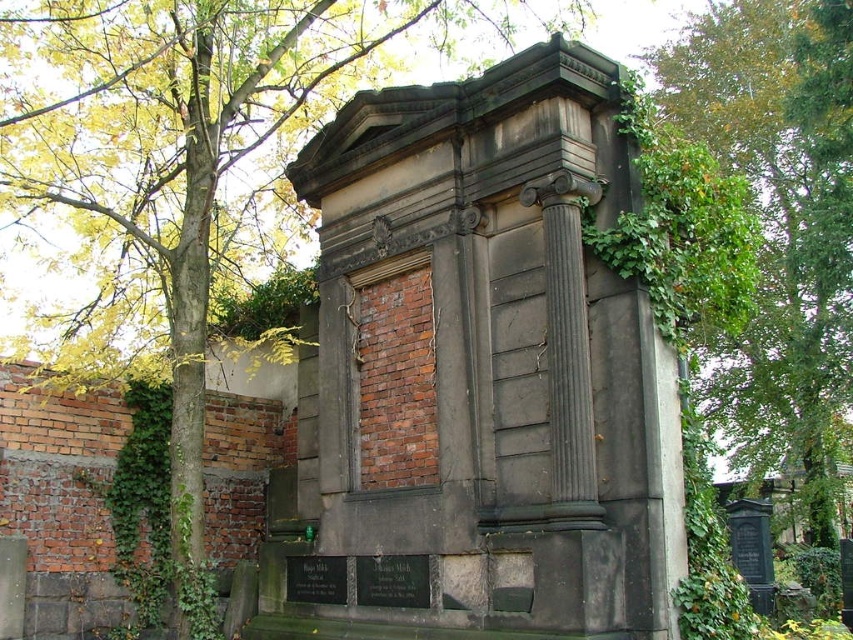
Question: Does green leafy tree at upper center appear over green leafy tree at upper right?

Choices:
 (A) yes
 (B) no

Answer: (A)

Question: In this image, where is green leafy tree at upper center located relative to green leafy tree at upper right?

Choices:
 (A) below
 (B) above

Answer: (B)

Question: Which of the following is the closest to the observer?

Choices:
 (A) dark gray stone monument at center
 (B) green leafy tree at upper center
 (C) green leafy tree at upper right

Answer: (A)

Question: Which of the following is the closest to the observer?

Choices:
 (A) (654, 560)
 (B) (792, 257)
 (C) (126, 140)

Answer: (A)

Question: Among these objects, which one is nearest to the camera?

Choices:
 (A) dark gray stone monument at center
 (B) green leafy tree at upper right

Answer: (A)

Question: Does dark gray stone monument at center have a lesser width compared to green leafy tree at upper right?

Choices:
 (A) no
 (B) yes

Answer: (B)